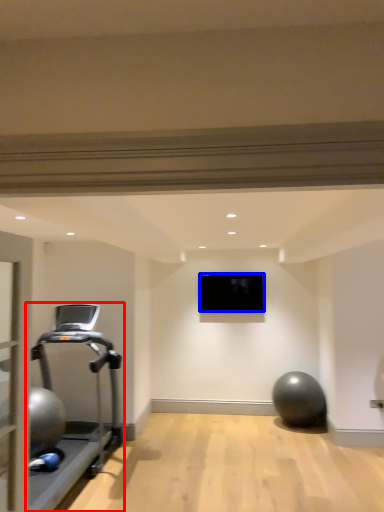
Question: Which object is closer to the camera taking this photo, treadmill (highlighted by a red box) or projection screen (highlighted by a blue box)?

Choices:
 (A) treadmill
 (B) projection screen

Answer: (A)